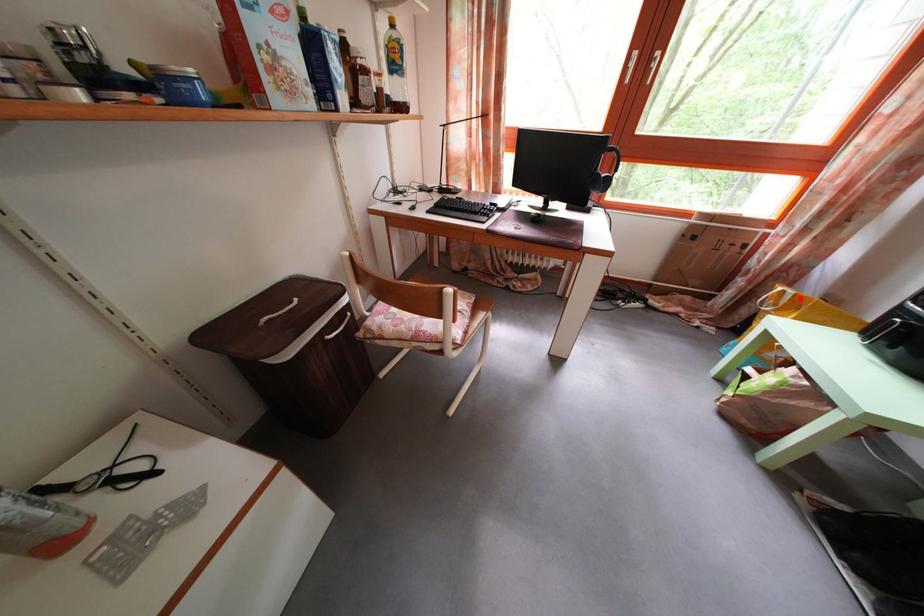
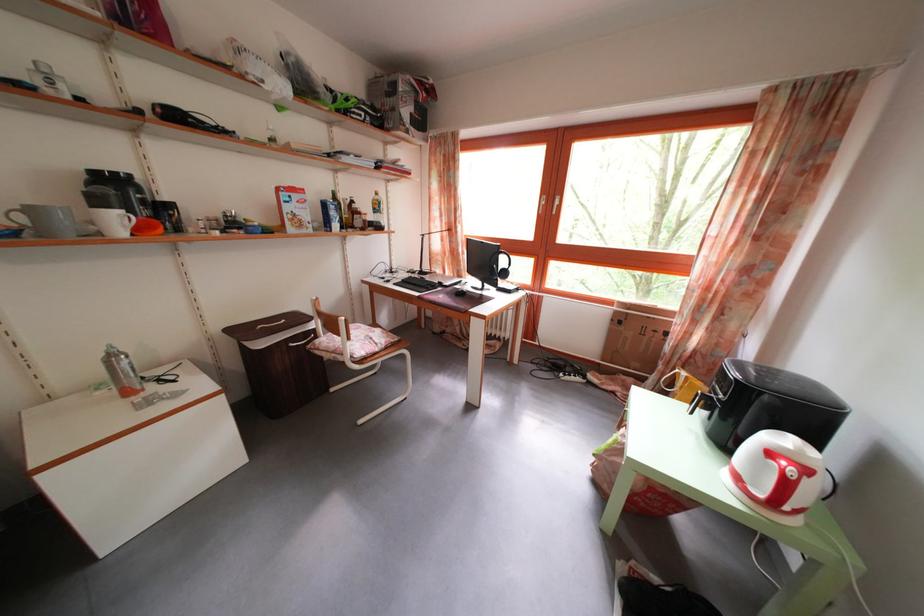
Question: I am providing you with two images of the same scene from different viewpoints. A red point is marked on the first image. Can you still see the location of the red point in image 2?

Choices:
 (A) Yes
 (B) No

Answer: (A)